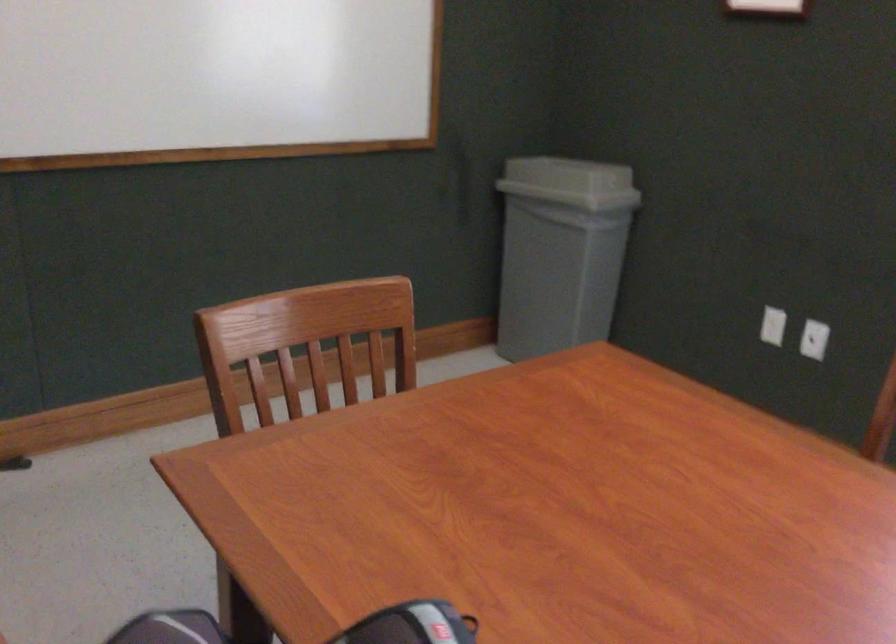
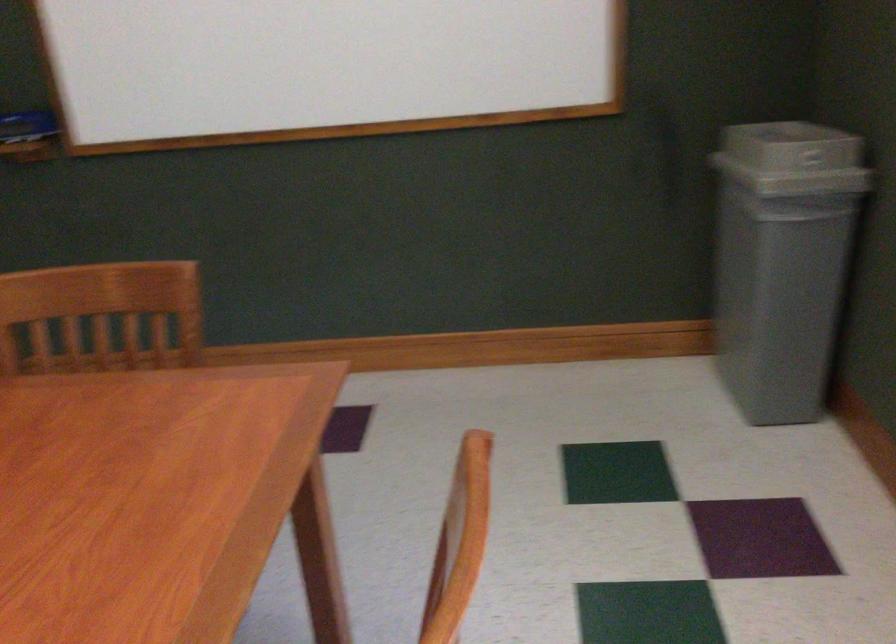
Locate, in the second image, the point that corresponds to [607,187] in the first image.

(793, 167)